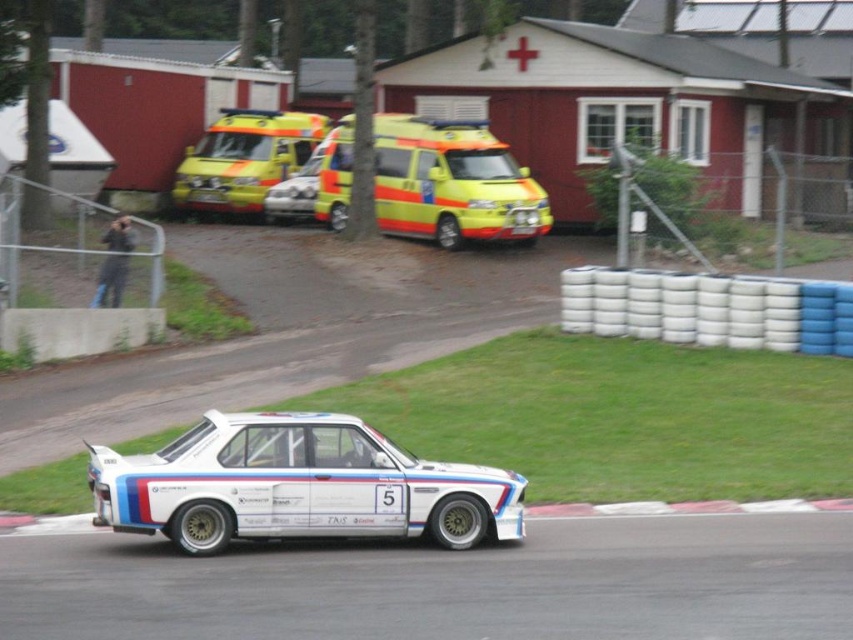
You are a race official at the event and need to ensure that both the white glossy car at center and the yellow reflective van at center can fit side by side in a 3.5 meter wide garage. Based on their widths, can both vehicles fit without overlapping?

The white glossy car at center might be wider than the yellow reflective van at center. If the car is wider than the van, their combined width could exceed 3.5 meters, so they might not fit side by side. The exact fit depends on their individual widths.

You are a drone operator tasked with capturing aerial footage of the vintage BMW race car. The drone must land on the white smooth asphalt at lower center. Given the coordinates provided in the Objects Description, can you confirm if the landing zone is within the visible scene?

The white smooth asphalt at lower center is located at point (450, 584), which falls within the visible scene coordinates, making it a suitable landing zone for the drone.

You are a spectator at the motorsport event and need to locate the two emergency vehicles. Which one is smaller in size between the yellowmatteambulance at upper center and the yellow reflective van at center?

The yellowmatteambulance at upper center is smaller in size compared to the yellow reflective van at center.